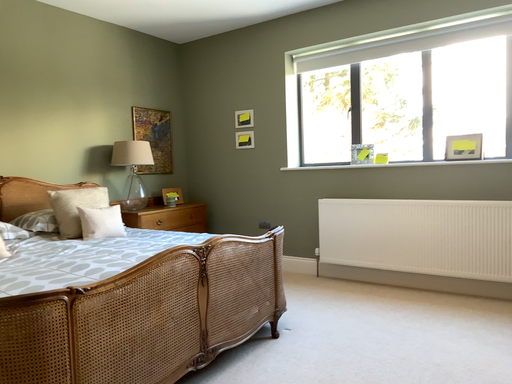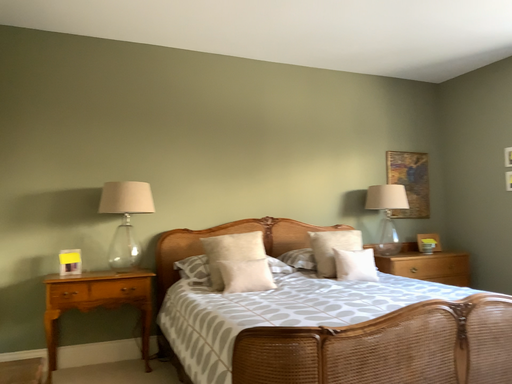
Question: How did the camera likely rotate when shooting the video?

Choices:
 (A) rotated right
 (B) rotated left

Answer: (B)